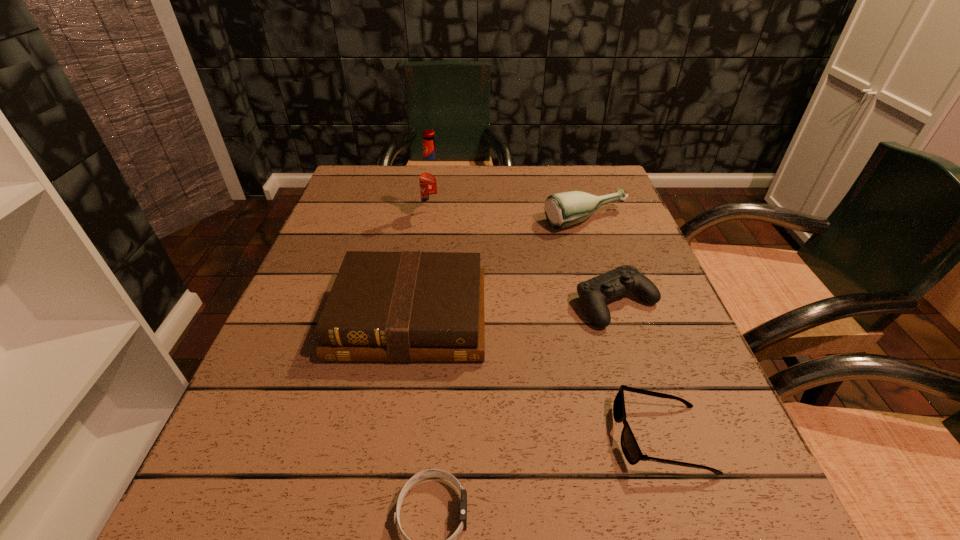
This screenshot has height=540, width=960. Find the location of `vacant area at the left edge`. vacant area at the left edge is located at coordinates (320, 410).

Identify the location of blank area at the right edge. (717, 400).

Locate an element on the screen. free space at the near left corner is located at coordinates (259, 494).

Find the location of `unoccupied position between the control and the fifth tallest object`. unoccupied position between the control and the fifth tallest object is located at coordinates pos(639,370).

You are a GUI agent. You are given a task and a screenshot of the screen. Output one action in this format:
    pyautogui.click(x=<x>, y=<y>)
    Task: Click on the vacant space that's between the tallest object and the second shortest object
    This screenshot has width=960, height=540.
    Given the screenshot: What is the action you would take?
    pyautogui.click(x=547, y=326)

Identify the location of free space between the sunglasses and the bottle. The width and height of the screenshot is (960, 540). (623, 329).

The height and width of the screenshot is (540, 960). I want to click on free space between the control and the sunglasses, so pyautogui.click(x=639, y=370).

Find the location of a particular element. vacant area that lies between the bottle and the control is located at coordinates (602, 262).

Where is `vacant space that is in between the bottle and the control`? The width and height of the screenshot is (960, 540). vacant space that is in between the bottle and the control is located at coordinates (602, 262).

The width and height of the screenshot is (960, 540). Find the location of `the second closest object to the Bible`. the second closest object to the Bible is located at coordinates (428, 473).